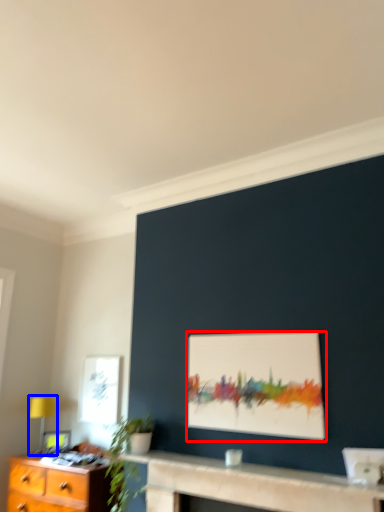
Question: Which of the following is the farthest to the observer, picture frame (highlighted by a red box) or table lamp (highlighted by a blue box)?

Choices:
 (A) picture frame
 (B) table lamp

Answer: (B)